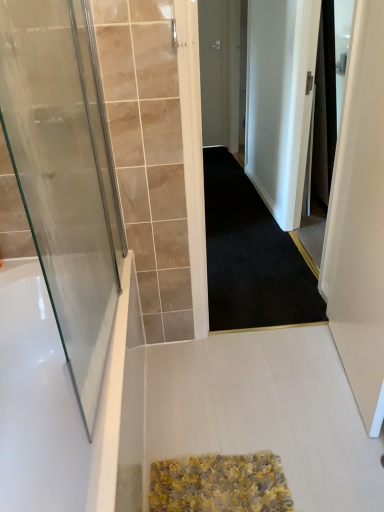
You are a GUI agent. You are given a task and a screenshot of the screen. Output one action in this format:
    pyautogui.click(x=<x>, y=<y>)
    Task: Click on the black fabric shower curtain at right
    
    Given the screenshot: What is the action you would take?
    pyautogui.click(x=324, y=109)

At what (x,y) coordinates should I click in order to perform the action: click on black carpet at center. Please return your answer as a coordinate pair (x, y). This screenshot has width=384, height=512. Looking at the image, I should click on (251, 256).

Describe the element at coordinates (62, 402) in the screenshot. I see `white glossy bathtub at left` at that location.

In order to face white glossy bathtub at left, should I rotate leftwards or rightwards?

You should rotate left by 18.353 degrees.

Describe the element at coordinates (214, 70) in the screenshot. I see `matte gray door at center, the 1th door viewed from the top` at that location.

The height and width of the screenshot is (512, 384). Identify the location of black fabric shower curtain at right. (324, 109).

Is matte gray door at center, marked as the second door in a left-to-right arrangement, in front of or behind transparent glass door at left, marked as the first door in a left-to-right arrangement, in the image?

matte gray door at center, marked as the second door in a left-to-right arrangement, is positioned farther from the viewer than transparent glass door at left, marked as the first door in a left-to-right arrangement.

Is matte gray door at center, the 2th door positioned from the bottom, thinner than transparent glass door at left, placed as the 2th door when sorted from back to front?

In fact, matte gray door at center, the 2th door positioned from the bottom, might be wider than transparent glass door at left, placed as the 2th door when sorted from back to front.

Is matte gray door at center, the 1th door from the right, not close to transparent glass door at left, which is counted as the 1th door, starting from the bottom?

Yes, matte gray door at center, the 1th door from the right, and transparent glass door at left, which is counted as the 1th door, starting from the bottom, are quite far apart.

Considering the positions of objects matte gray door at center, marked as the second door in a left-to-right arrangement, and transparent glass door at left, acting as the 2th door starting from the top, in the image provided, who is more to the right, matte gray door at center, marked as the second door in a left-to-right arrangement, or transparent glass door at left, acting as the 2th door starting from the top,?

matte gray door at center, marked as the second door in a left-to-right arrangement.

Is white matte screen door at right oriented towards transparent glass door at left, arranged as the 1th door when viewed from the front?

Yes.

Considering the relative sizes of white matte screen door at right and transparent glass door at left, which is counted as the 1th door, starting from the bottom, in the image provided, is white matte screen door at right wider than transparent glass door at left, which is counted as the 1th door, starting from the bottom,?

Correct, the width of white matte screen door at right exceeds that of transparent glass door at left, which is counted as the 1th door, starting from the bottom.

Which is in front, point (359, 3) or point (118, 234)?

The point (118, 234) is in front.

Considering the sizes of objects white matte screen door at right and transparent glass door at left, arranged as the 1th door when viewed from the front, in the image provided, who is taller, white matte screen door at right or transparent glass door at left, arranged as the 1th door when viewed from the front,?

white matte screen door at right is taller.

Which is closer to the camera, (x=32, y=292) or (x=85, y=391)?

Point (x=32, y=292) is farther from the camera than point (x=85, y=391).

Is white glossy bathtub at left with transparent glass door at left, acting as the 2th door starting from the top?

white glossy bathtub at left is not next to transparent glass door at left, acting as the 2th door starting from the top, and they're not touching.

From the image's perspective, is white glossy bathtub at left on top of transparent glass door at left, arranged as the 1th door when viewed from the front?

Actually, white glossy bathtub at left appears below transparent glass door at left, arranged as the 1th door when viewed from the front, in the image.

Is white glossy bathtub at left positioned behind transparent glass door at left, marked as the first door in a left-to-right arrangement?

That is True.

Which of these two, white matte screen door at right or white glossy bathtub at left, is wider?

With larger width is white glossy bathtub at left.

From the image's perspective, which one is positioned lower, white matte screen door at right or white glossy bathtub at left?

white glossy bathtub at left.

Relative to white glossy bathtub at left, is white matte screen door at right in front or behind?

white matte screen door at right is in front of white glossy bathtub at left.

In the scene shown: Can you confirm if white matte screen door at right is shorter than white glossy bathtub at left?

Incorrect, the height of white matte screen door at right does not fall short of that of white glossy bathtub at left.

Consider the image. Is transparent glass door at left, marked as the first door in a left-to-right arrangement, positioned with its back to black carpet at center?

No, transparent glass door at left, marked as the first door in a left-to-right arrangement, is not facing away from black carpet at center.

Is transparent glass door at left, arranged as the 1th door when viewed from the front, far from black carpet at center?

transparent glass door at left, arranged as the 1th door when viewed from the front, is positioned a significant distance from black carpet at center.

Between transparent glass door at left, marked as the first door in a left-to-right arrangement, and black carpet at center, which one appears on the left side from the viewer's perspective?

transparent glass door at left, marked as the first door in a left-to-right arrangement, is more to the left.

Based on the photo, from the image's perspective, is transparent glass door at left, acting as the 2th door starting from the top, below black carpet at center?

Yes, from the image's perspective, transparent glass door at left, acting as the 2th door starting from the top, is below black carpet at center.

Looking at the image, does transparent glass door at left, the 2th door in the right-to-left sequence, seem bigger or smaller compared to white glossy bathtub at left?

In the image, transparent glass door at left, the 2th door in the right-to-left sequence, appears to be smaller than white glossy bathtub at left.

Would you say transparent glass door at left, arranged as the 1th door when viewed from the front, is to the left or to the right of white glossy bathtub at left in the picture?

Based on their positions, transparent glass door at left, arranged as the 1th door when viewed from the front, is located to the right of white glossy bathtub at left.

Is transparent glass door at left, marked as the first door in a left-to-right arrangement, not close to white glossy bathtub at left?

No.

Is transparent glass door at left, marked as the first door in a left-to-right arrangement, oriented away from white glossy bathtub at left?

transparent glass door at left, marked as the first door in a left-to-right arrangement, does not have its back to white glossy bathtub at left.

Considering the relative sizes of black fabric shower curtain at right and white glossy bathtub at left in the image provided, is black fabric shower curtain at right bigger than white glossy bathtub at left?

Incorrect, black fabric shower curtain at right is not larger than white glossy bathtub at left.

Would you say black fabric shower curtain at right is to the left or to the right of white glossy bathtub at left in the picture?

Based on their positions, black fabric shower curtain at right is located to the right of white glossy bathtub at left.

Is point (321, 51) positioned behind point (43, 328)?

Yes, it is.

Locate an element on the screen. The height and width of the screenshot is (512, 384). door above the transparent glass door at left, arranged as the 1th door when viewed from the front (from the image's perspective) is located at coordinates (214, 70).

I want to click on screen door that appears below the transparent glass door at left, which is counted as the 1th door, starting from the bottom (from the image's perspective), so click(359, 219).

Consider the image. Considering their positions, is matte gray door at center, which appears as the 1th door when viewed from the back, positioned closer to transparent glass door at left, acting as the 2th door starting from the top, than white matte screen door at right?

The object closer to transparent glass door at left, acting as the 2th door starting from the top, is white matte screen door at right.

Looking at the image, which one is located further to black carpet at center, matte gray door at center, the 2th door positioned from the bottom, or white glossy bathtub at left?

matte gray door at center, the 2th door positioned from the bottom.

Estimate the real-world distances between objects in this image. Which object is closer to black fabric shower curtain at right, black carpet at center or white glossy bathtub at left?

Among the two, black carpet at center is located nearer to black fabric shower curtain at right.

From the image, which object appears to be farther from white matte screen door at right, transparent glass door at left, marked as the first door in a left-to-right arrangement, or matte gray door at center, the 1th door viewed from the top?

Based on the image, matte gray door at center, the 1th door viewed from the top, appears to be further to white matte screen door at right.

Which object lies nearer to the anchor point transparent glass door at left, marked as the first door in a left-to-right arrangement, white glossy bathtub at left or white matte screen door at right?

white glossy bathtub at left is closer to transparent glass door at left, marked as the first door in a left-to-right arrangement.

Which object lies nearer to the anchor point white matte screen door at right, white glossy bathtub at left or matte gray door at center, the 2th door positioned from the bottom?

white glossy bathtub at left.

When comparing their distances from matte gray door at center, the 2th door positioned from the front, does white matte screen door at right or transparent glass door at left, acting as the 2th door starting from the top, seem closer?

Based on the image, white matte screen door at right appears to be nearer to matte gray door at center, the 2th door positioned from the front.

Which object lies nearer to the anchor point matte gray door at center, which appears as the 1th door when viewed from the back, black carpet at center or black fabric shower curtain at right?

The object closer to matte gray door at center, which appears as the 1th door when viewed from the back, is black carpet at center.

Where is `screen door positioned between transparent glass door at left, arranged as the 1th door when viewed from the front, and black fabric shower curtain at right from near to far`? This screenshot has height=512, width=384. screen door positioned between transparent glass door at left, arranged as the 1th door when viewed from the front, and black fabric shower curtain at right from near to far is located at coordinates (359, 219).

Locate an element on the screen. This screenshot has width=384, height=512. shower curtain between white glossy bathtub at left and matte gray door at center, the 2th door positioned from the bottom, along the z-axis is located at coordinates (324, 109).

This screenshot has height=512, width=384. What are the coordinates of `bath located between white matte screen door at right and black fabric shower curtain at right in the depth direction` in the screenshot? It's located at (62, 402).

The height and width of the screenshot is (512, 384). I want to click on doormat between white glossy bathtub at left and black fabric shower curtain at right along the z-axis, so click(x=251, y=256).